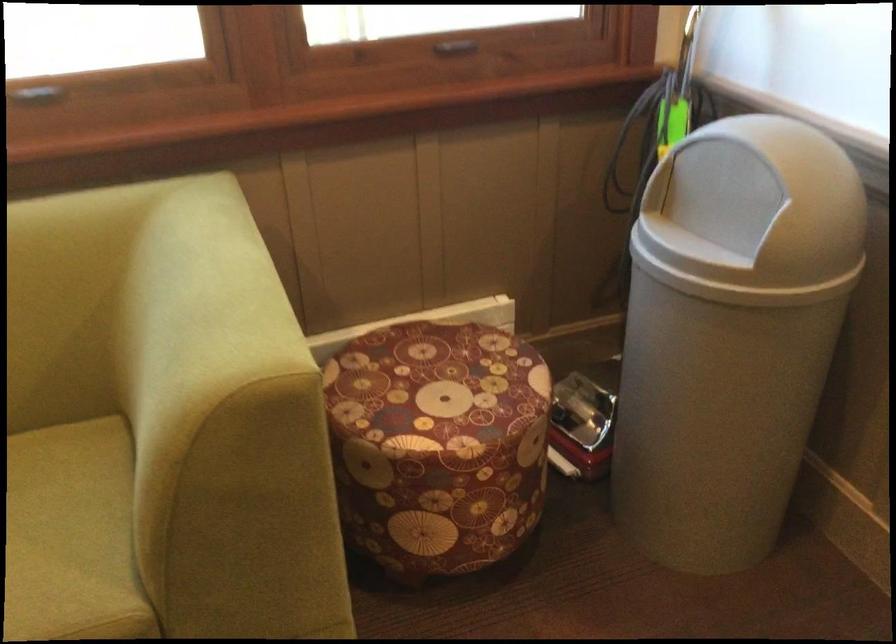
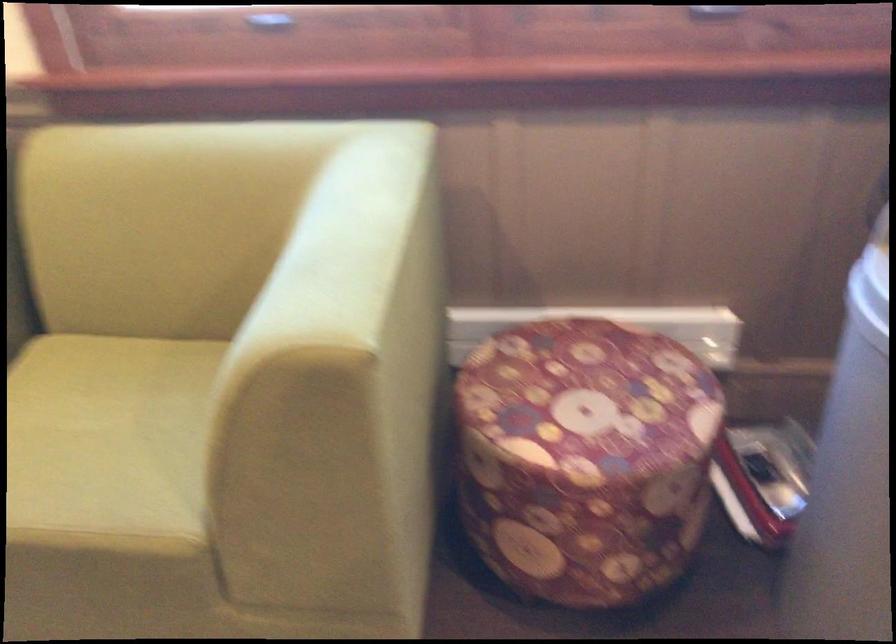
The point at (x=225, y=269) is marked in the first image. Where is the corresponding point in the second image?

(358, 223)